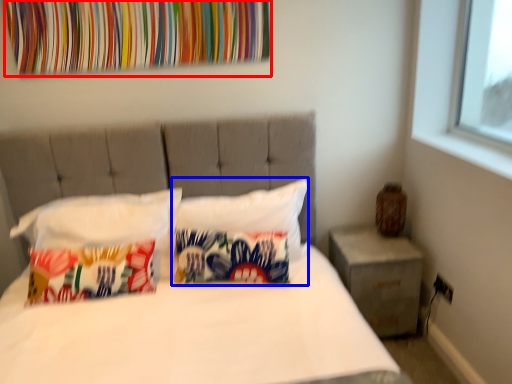
Question: Which of the following is the closest to the observer, tapestry (highlighted by a red box) or pillow (highlighted by a blue box)?

Choices:
 (A) tapestry
 (B) pillow

Answer: (A)